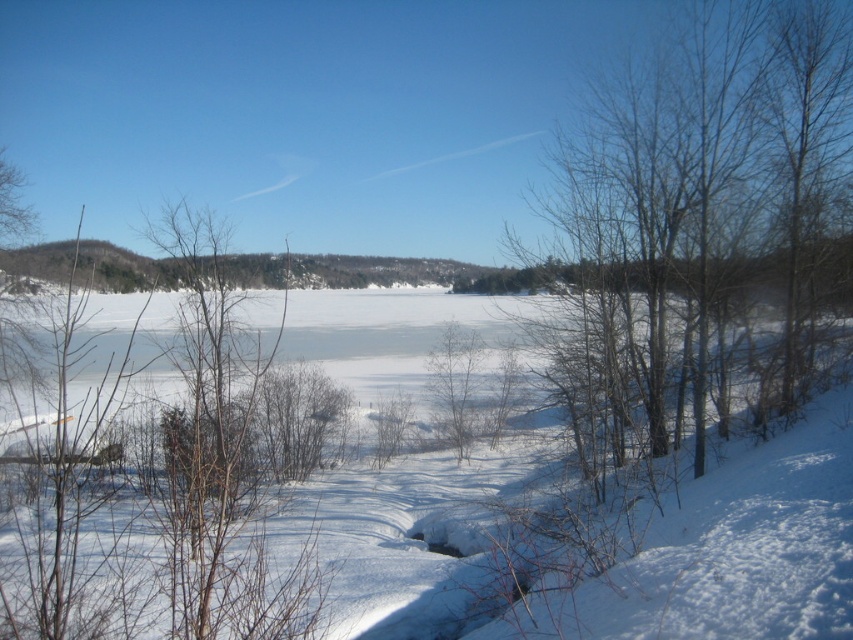
You are standing in the winter landscape and want to take a photo of the white fluffy snow at center. To avoid the bare branches at right from blocking the view, which direction should you move to position yourself?

You should move to the left to position yourself so that the bare branches at right are no longer blocking the view of the white fluffy snow at center, since the bare branches at right is to the right of white fluffy snow at center.

You are an artist trying to sketch this winter scene. You notice the bare branches at right and the white fluffy snow at center. Which object would you need to draw with finer details to capture their actual thickness in your drawing?

The bare branches at right are thinner than the white fluffy snow at center, so you should draw the bare branches at right with finer details to accurately represent their thickness.